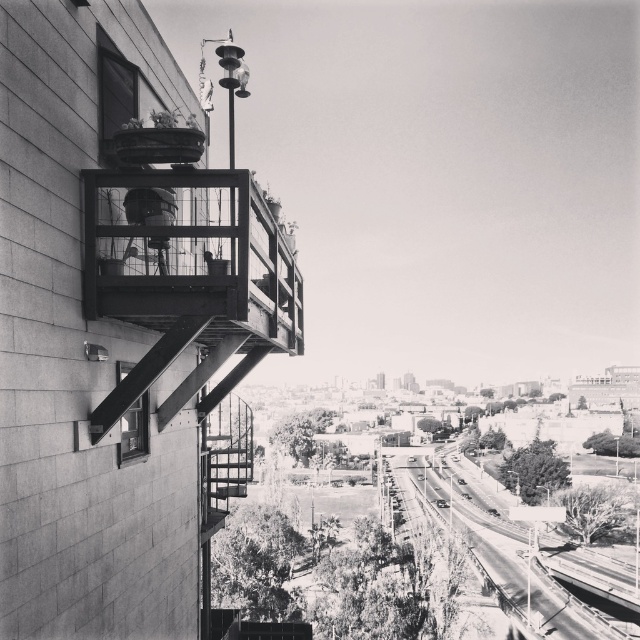
Question: Can you confirm if smooth asphalt road at lower center is positioned below clear glass window at lower left?

Choices:
 (A) yes
 (B) no

Answer: (A)

Question: Considering the relative positions of smooth asphalt road at lower center and clear glass window at lower left in the image provided, where is smooth asphalt road at lower center located with respect to clear glass window at lower left?

Choices:
 (A) right
 (B) left

Answer: (A)

Question: Which object is positioned closest to the smooth asphalt road at lower center?

Choices:
 (A) clear glass window at lower left
 (B) wooden balcony at center

Answer: (B)

Question: Is smooth asphalt road at lower center below clear glass window at lower left?

Choices:
 (A) yes
 (B) no

Answer: (A)

Question: Which point is closer to the camera?

Choices:
 (A) wooden balcony at center
 (B) smooth asphalt road at lower center
 (C) clear glass window at lower left

Answer: (A)

Question: Which point is closer to the camera?

Choices:
 (A) clear glass window at lower left
 (B) smooth asphalt road at lower center
 (C) wooden balcony at center

Answer: (C)